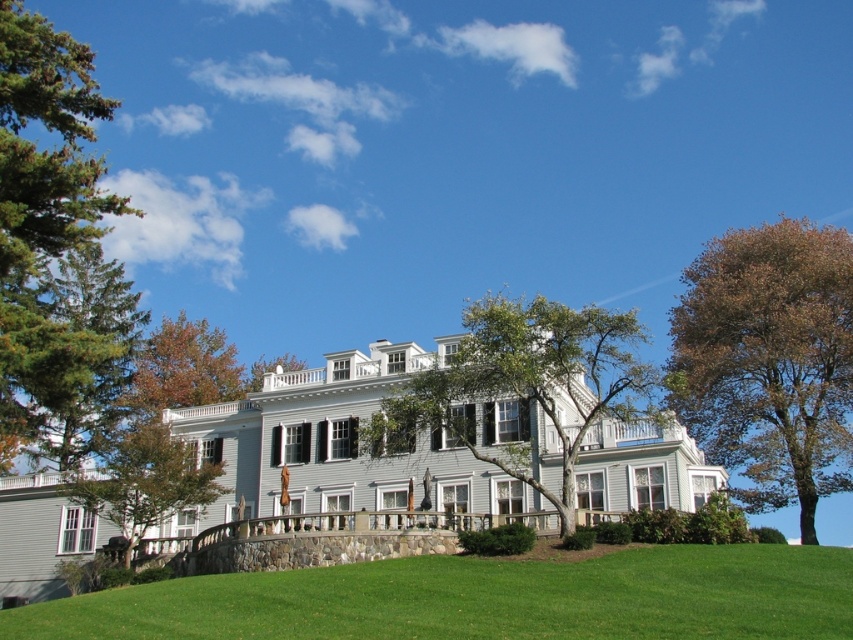
Can you confirm if green leafy tree at center is smaller than green leafy tree at lower left?

Actually, green leafy tree at center might be larger than green leafy tree at lower left.

Who is lower down, green leafy tree at center or green leafy tree at lower left?

Positioned lower is green leafy tree at lower left.

Who is more forward, (440, 417) or (166, 438)?

Point (440, 417) is in front.

Locate an element on the screen. green leafy tree at center is located at coordinates coord(521,385).

Can you confirm if green needle-like at left is smaller than green leafy tree at center?

Incorrect, green needle-like at left is not smaller in size than green leafy tree at center.

Is point (59, 83) positioned after point (583, 396)?

That is False.

In order to click on green needle-like at left in this screenshot , I will do 44,216.

Who is positioned more to the right, green grass at lower center or green leafy tree at lower left?

From the viewer's perspective, green grass at lower center appears more on the right side.

Locate an element on the screen. This screenshot has width=853, height=640. green grass at lower center is located at coordinates (482, 598).

Locate an element on the screen. green grass at lower center is located at coordinates (482, 598).